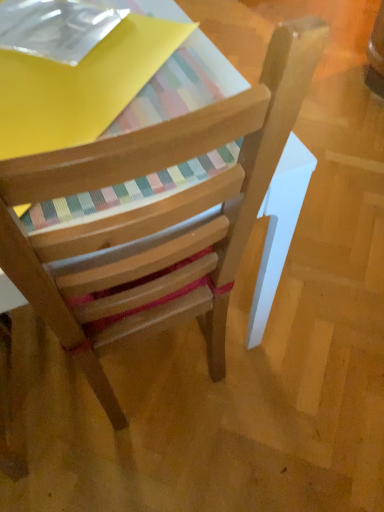
Question: Which is correct: transparent plastic paperback book at upper left is inside wooden chair at center, or outside of it?

Choices:
 (A) outside
 (B) inside

Answer: (A)

Question: In terms of width, does transparent plastic paperback book at upper left look wider or thinner when compared to wooden chair at center?

Choices:
 (A) thin
 (B) wide

Answer: (A)

Question: Considering the positions of transparent plastic paperback book at upper left and wooden chair at center in the image, is transparent plastic paperback book at upper left bigger or smaller than wooden chair at center?

Choices:
 (A) big
 (B) small

Answer: (B)

Question: Considering the positions of point (127, 137) and point (36, 36), is point (127, 137) closer or farther from the camera than point (36, 36)?

Choices:
 (A) closer
 (B) farther

Answer: (A)

Question: In terms of height, does wooden chair at center look taller or shorter compared to transparent plastic paperback book at upper left?

Choices:
 (A) short
 (B) tall

Answer: (B)

Question: From the image's perspective, is wooden chair at center located above or below transparent plastic paperback book at upper left?

Choices:
 (A) above
 (B) below

Answer: (B)

Question: From a real-world perspective, is wooden chair at center positioned above or below transparent plastic paperback book at upper left?

Choices:
 (A) above
 (B) below

Answer: (B)